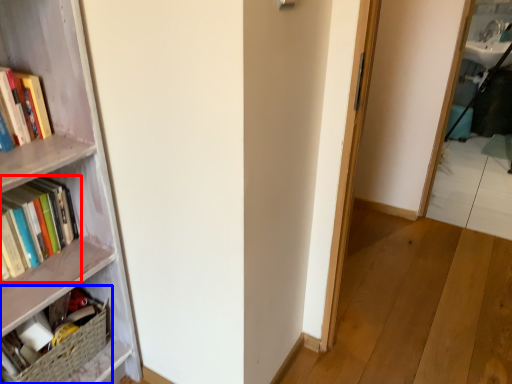
Question: Among these objects, which one is nearest to the camera, book (highlighted by a red box) or book (highlighted by a blue box)?

Choices:
 (A) book
 (B) book

Answer: (A)